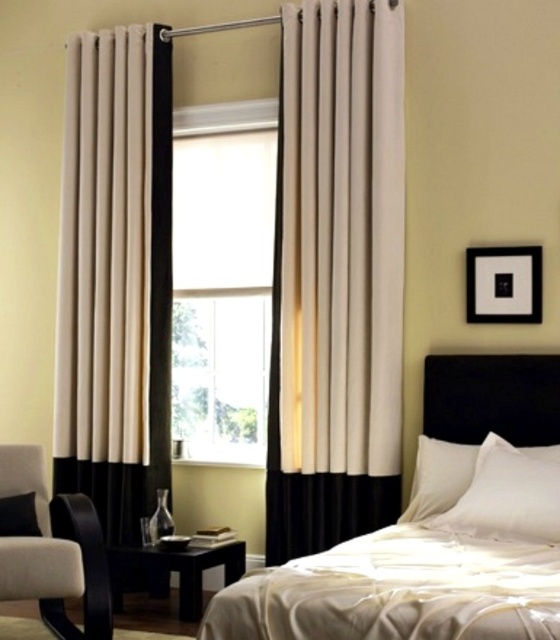
Question: Which point is farther from the camera taking this photo?

Choices:
 (A) (161, 548)
 (B) (466, 289)
 (C) (16, 515)
 (D) (142, 301)

Answer: (D)

Question: Does beige fabric armchair at left have a larger size compared to white matte pillow at lower left?

Choices:
 (A) yes
 (B) no

Answer: (A)

Question: Where is white matte window at center located in relation to black matte picture frame at upper right in the image?

Choices:
 (A) right
 (B) left

Answer: (B)

Question: Is white satin pillow at center above white matte pillow at lower left?

Choices:
 (A) no
 (B) yes

Answer: (B)

Question: Which object appears closest to the camera in this image?

Choices:
 (A) beige fabric armchair at left
 (B) black matte picture frame at upper right
 (C) white satin bed at center
 (D) cream/textured fabric curtain at left

Answer: (C)

Question: Among these objects, which one is nearest to the camera?

Choices:
 (A) black glossy side table at lower left
 (B) white matte pillow at lower left

Answer: (B)